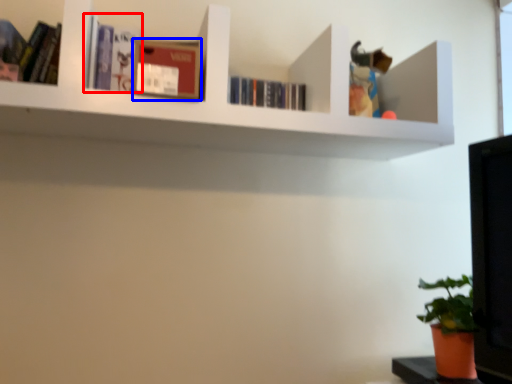
Question: Which object is closer to the camera taking this photo, book (highlighted by a red box) or paperback book (highlighted by a blue box)?

Choices:
 (A) book
 (B) paperback book

Answer: (B)